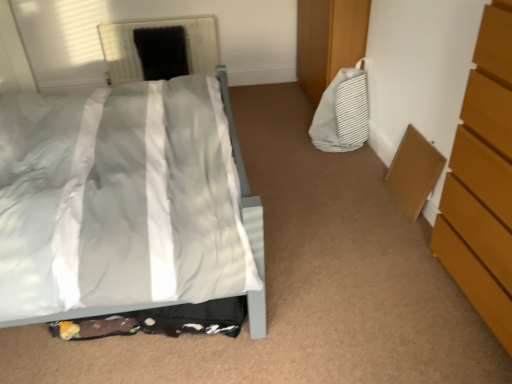
Question: From their relative heights in the image, would you say white glossy bed at center is taller or shorter than white striped fabric bag at right?

Choices:
 (A) tall
 (B) short

Answer: (A)

Question: Considering their positions, is white glossy bed at center located in front of or behind white striped fabric bag at right?

Choices:
 (A) front
 (B) behind

Answer: (A)

Question: Which object is positioned closest to the white striped fabric bag at right?

Choices:
 (A) wooden chest of drawers at right
 (B) black matte screen door at upper center
 (C) white glossy bed at center

Answer: (C)

Question: Estimate the real-world distances between objects in this image. Which object is closer to the black matte screen door at upper center?

Choices:
 (A) white glossy bed at center
 (B) wooden chest of drawers at right
 (C) white striped fabric bag at right

Answer: (C)